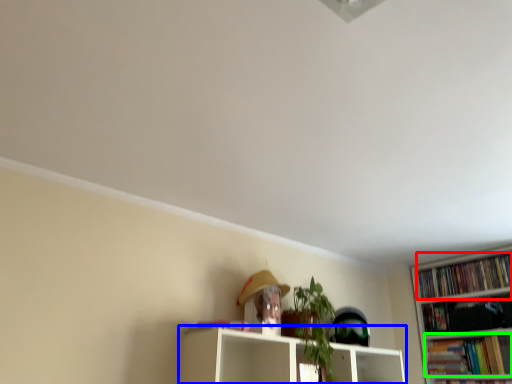
Question: Based on their relative distances, which object is nearer to book (highlighted by a red box)? Choose from shelf (highlighted by a blue box) and book (highlighted by a green box).

Choices:
 (A) shelf
 (B) book

Answer: (B)